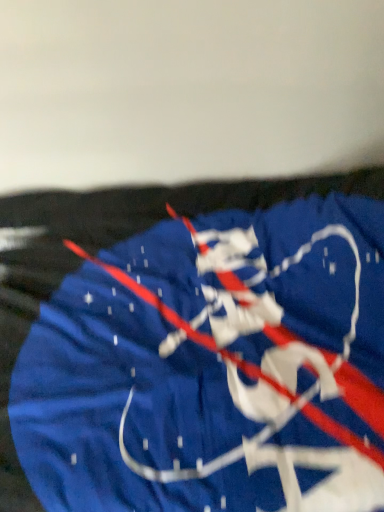
The image size is (384, 512). Find the location of `blue fabric flag at center`. blue fabric flag at center is located at coordinates (x=213, y=367).

Measure the distance between blue fabric flag at center and camera.

The distance of blue fabric flag at center from camera is 24.66 inches.

This screenshot has height=512, width=384. What do you see at coordinates (213, 367) in the screenshot?
I see `blue fabric flag at center` at bounding box center [213, 367].

What are the coordinates of `blue fabric flag at center` in the screenshot? It's located at (213, 367).